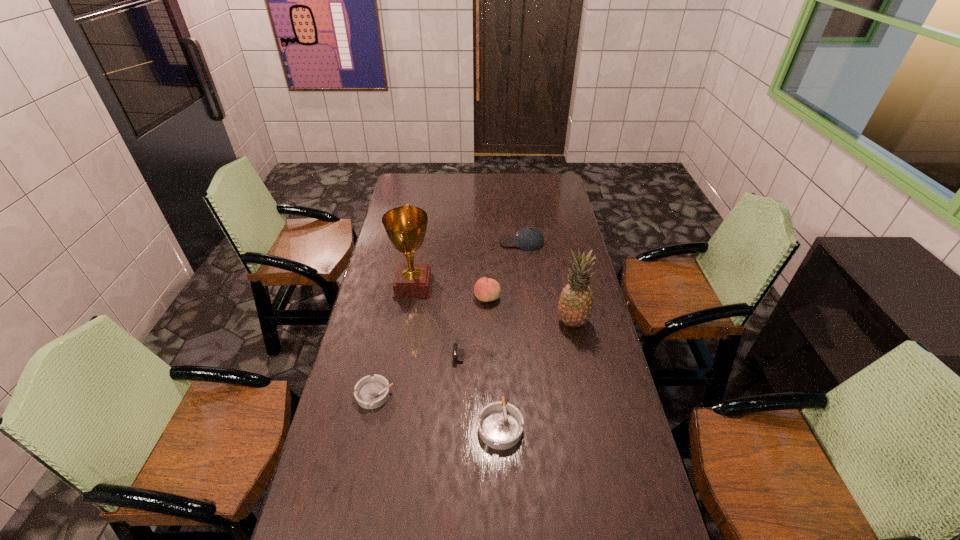
Where is `the shortest object`? the shortest object is located at coordinates (370, 392).

At what (x,y) coordinates should I click in order to perform the action: click on the shorter ashtray. Please return your answer as a coordinate pair (x, y). Looking at the image, I should click on pyautogui.click(x=370, y=392).

Locate an element on the screen. The image size is (960, 540). the right ashtray is located at coordinates (500, 426).

The image size is (960, 540). What are the coordinates of `the fifth shortest object` in the screenshot? It's located at (486, 289).

You are a GUI agent. You are given a task and a screenshot of the screen. Output one action in this format:
    pyautogui.click(x=<x>, y=<y>)
    Task: Click on the farthest object
    
    Given the screenshot: What is the action you would take?
    pyautogui.click(x=528, y=238)

The height and width of the screenshot is (540, 960). Identify the location of the fourth tallest object. (528, 238).

Locate an element on the screen. Image resolution: width=960 pixels, height=540 pixels. award is located at coordinates (405, 226).

Locate an element on the screen. the fourth farthest object is located at coordinates tap(575, 306).

Find the location of a particular element. the fifth farthest object is located at coordinates (458, 354).

Locate an element on the screen. vacant space located 0.350m on the right of the left ashtray is located at coordinates (505, 395).